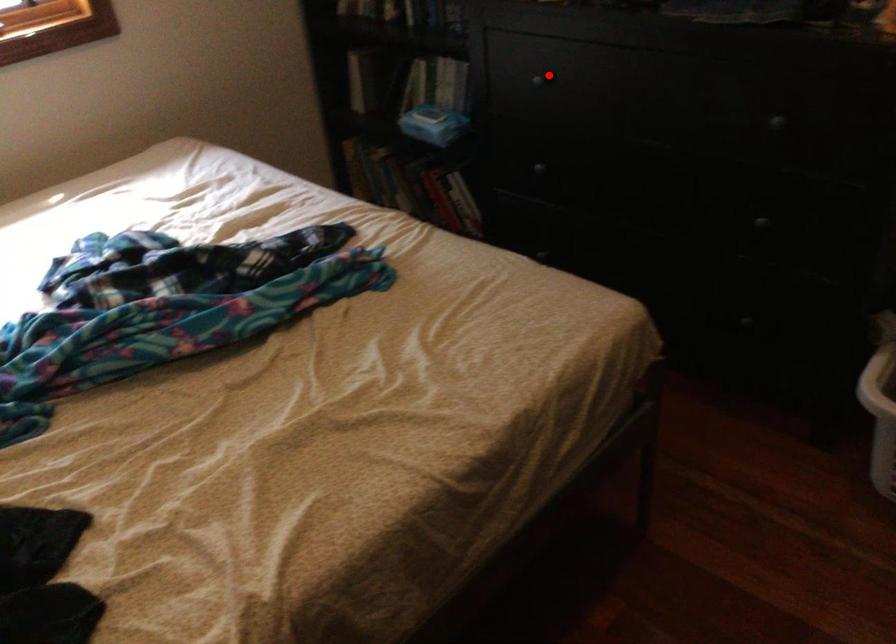
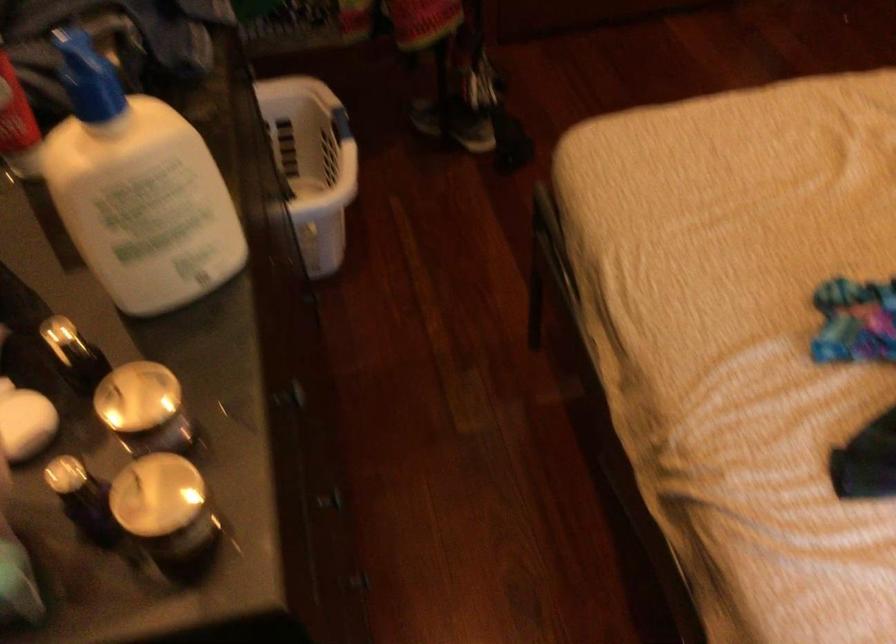
Question: I am providing you with two images of the same scene from different viewpoints. Given a red point in image1, look at the same physical point in image2. Is it:

Choices:
 (A) Closer to the viewpoint
 (B) Farther from the viewpoint

Answer: (A)